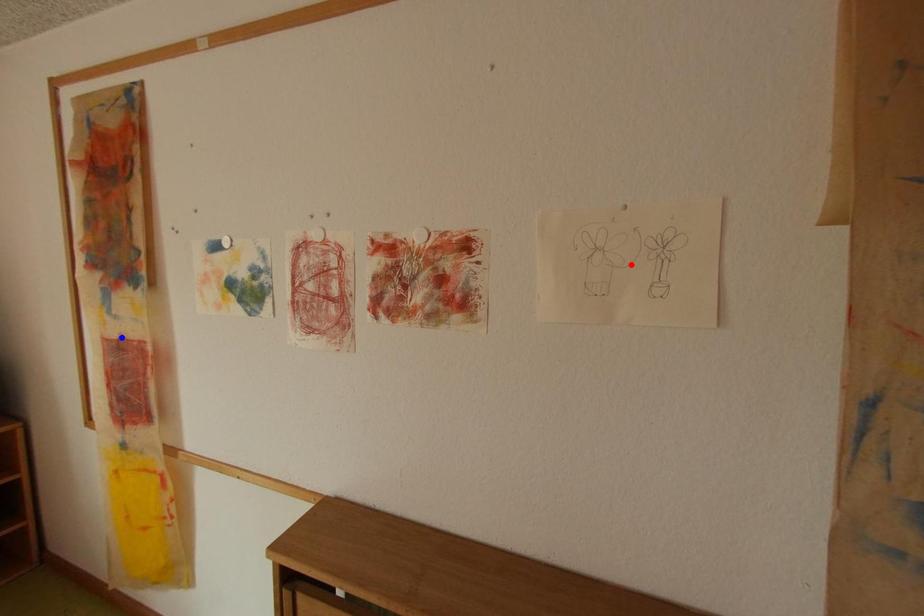
Question: Which of the two points in the image is closer to the camera?

Choices:
 (A) Blue point is closer.
 (B) Red point is closer.

Answer: (B)